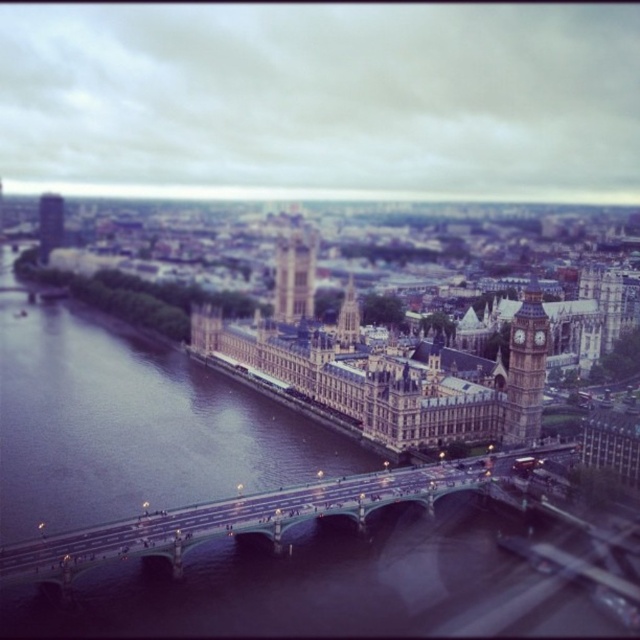
Which is above, stone clock tower at center or golden stone big ben at upper left?

golden stone big ben at upper left is higher up.

The image size is (640, 640). What do you see at coordinates (294, 276) in the screenshot?
I see `stone clock tower at center` at bounding box center [294, 276].

Identify the location of stone clock tower at center. This screenshot has width=640, height=640. (294, 276).

Is stone clock tower at right smaller than stone clock tower at center?

No.

Which is in front, point (538, 433) or point (284, 266)?

Point (538, 433)

Where is `stone clock tower at right`? The image size is (640, 640). stone clock tower at right is located at coordinates (525, 369).

Does metallic gray bridge at center lie in front of stone clock tower at center?

Yes, metallic gray bridge at center is in front of stone clock tower at center.

Locate an element on the screen. metallic gray bridge at center is located at coordinates (228, 520).